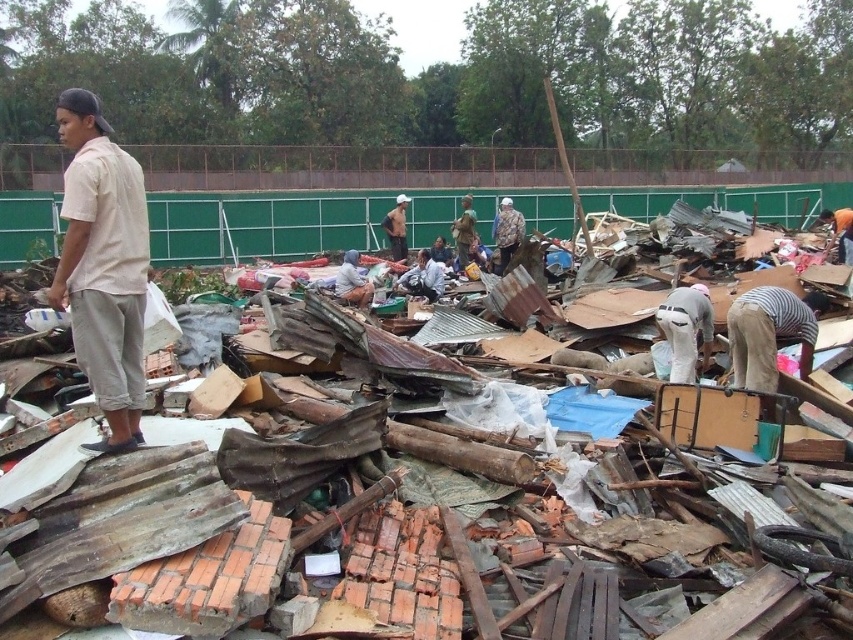
You are a drone operator tasked with capturing aerial images of the construction site. You need to locate the camouflage jacket at center for a safety check. According to the coordinates provided, where should you direct the drone to focus its camera?

The camouflage jacket at center is located at the 2D coordinates point [508,230], so the drone should focus its camera there to locate it.

You are standing at the origin point in the debris field and see two points marked on the ground. The first is at point (509,257) and the second is at point (456,240). Which point is closer to you?

Point (509,257) is in front of point (456,240), so it is closer to you.